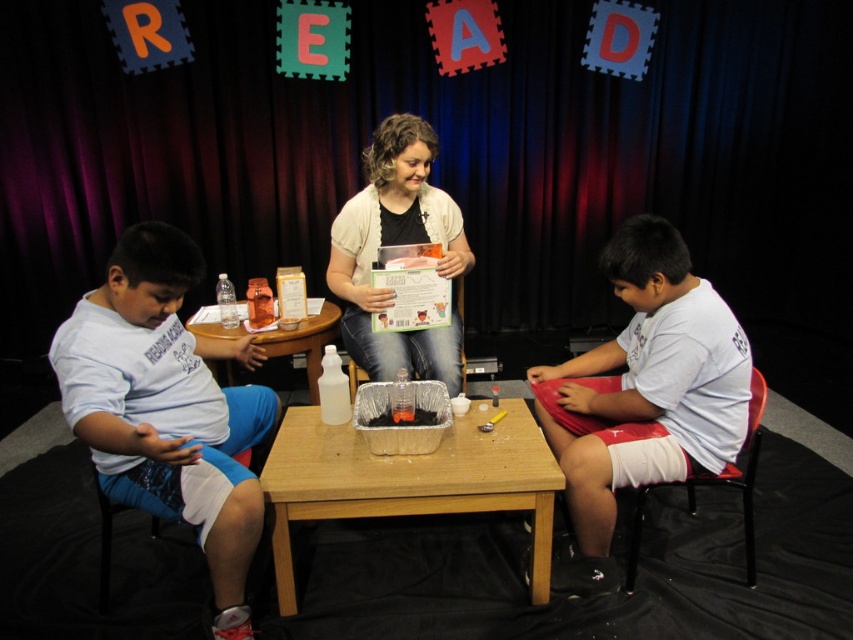
Question: Is light blue cotton shorts at left above white matte cardigan at center?

Choices:
 (A) yes
 (B) no

Answer: (B)

Question: From the image, what is the correct spatial relationship of wooden table at center in relation to white matte cardigan at center?

Choices:
 (A) right
 (B) left

Answer: (A)

Question: Among these objects, which one is farthest from the camera?

Choices:
 (A) light blue cotton shorts at left
 (B) translucent plastic table at center
 (C) wooden table at center
 (D) white matte cardigan at center

Answer: (D)

Question: Which object is positioned closest to the white cotton shirt at right?

Choices:
 (A) light blue cotton shorts at left
 (B) translucent plastic table at center
 (C) wooden table at center

Answer: (C)

Question: Does light blue cotton shorts at left appear under white matte cardigan at center?

Choices:
 (A) no
 (B) yes

Answer: (B)

Question: Which object appears farthest from the camera in this image?

Choices:
 (A) wooden table at center
 (B) white matte cardigan at center
 (C) translucent plastic table at center
 (D) translucent plastic container at center

Answer: (B)